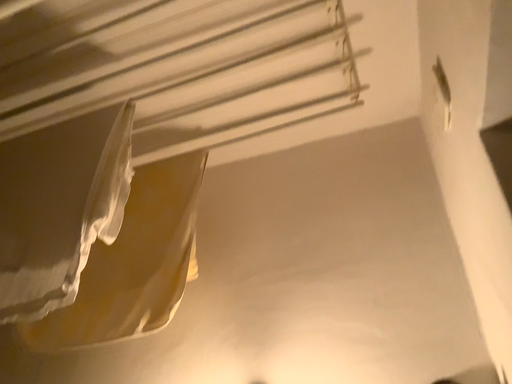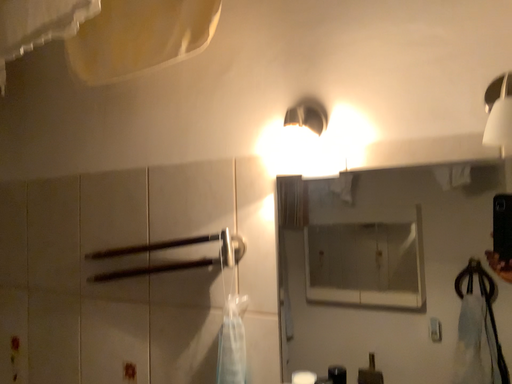
Question: Which way did the camera rotate in the video?

Choices:
 (A) rotated right
 (B) rotated left

Answer: (B)